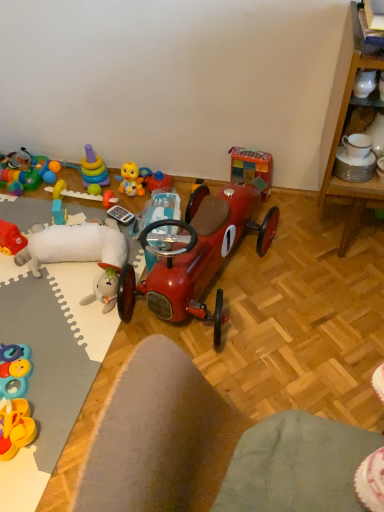
The height and width of the screenshot is (512, 384). I want to click on free location to the left of translucent plastic block at upper left, which is the 9th toy in right-to-left order, so click(33, 214).